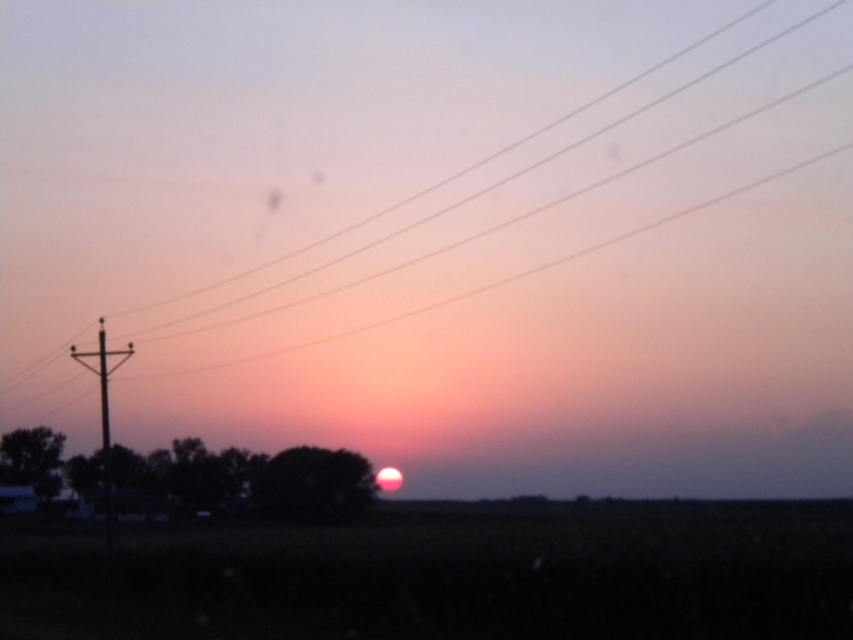
Question: Among these points, which one is farthest from the camera?

Choices:
 (A) (59, 458)
 (B) (126, 358)

Answer: (A)

Question: Estimate the real-world distances between objects in this image. Which object is farther from the metallic wires at upper center?

Choices:
 (A) silhouette tree at center
 (B) smooth wood telegraph pole at left

Answer: (A)

Question: Considering the relative positions of metallic wires at upper center and smooth wood telegraph pole at left in the image provided, where is metallic wires at upper center located with respect to smooth wood telegraph pole at left?

Choices:
 (A) above
 (B) below

Answer: (A)

Question: Does green matte tree at lower center appear over green matte tree at lower left?

Choices:
 (A) no
 (B) yes

Answer: (A)

Question: Which of the following is the closest to the observer?

Choices:
 (A) (10, 381)
 (B) (300, 468)

Answer: (B)

Question: Is metallic wires at upper center positioned behind green matte tree at lower left?

Choices:
 (A) yes
 (B) no

Answer: (A)